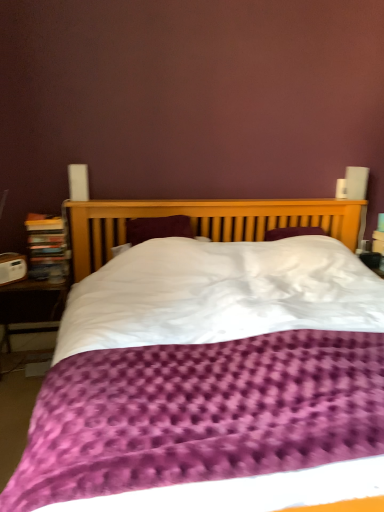
Question: In the image, is purple textured duvet at center on the left side or the right side of wooden table at lower left?

Choices:
 (A) left
 (B) right

Answer: (B)

Question: Considering the positions of purple textured duvet at center and wooden table at lower left in the image, is purple textured duvet at center bigger or smaller than wooden table at lower left?

Choices:
 (A) small
 (B) big

Answer: (B)

Question: Considering the real-world distances, which object is farthest from the purple textured duvet at center?

Choices:
 (A) wooden bookcase at left
 (B) wooden table at lower left

Answer: (B)

Question: Which object is positioned closest to the purple textured duvet at center?

Choices:
 (A) wooden bookcase at left
 (B) wooden table at lower left

Answer: (A)